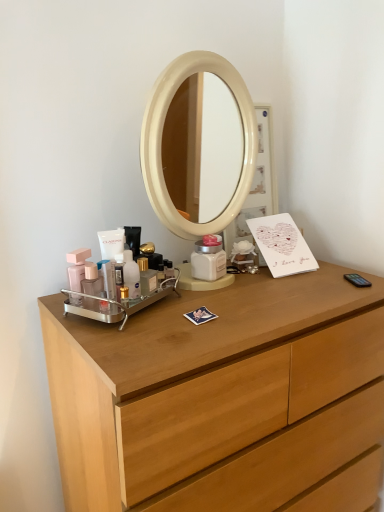
The image size is (384, 512). In order to click on vacant area located to the right-hand side of translucent plastic bottle at center, the 1th toiletry when ordered from right to left in this screenshot , I will do `click(180, 303)`.